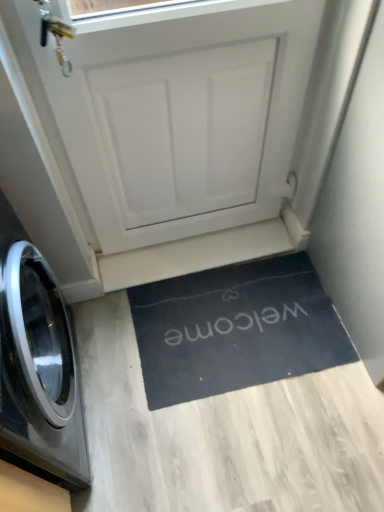
Question: From a real-world perspective, relative to black glossy washing machine at left, is white matte door at center vertically above or below?

Choices:
 (A) below
 (B) above

Answer: (B)

Question: Does point tap(261, 88) appear closer or farther from the camera than point tap(3, 270)?

Choices:
 (A) farther
 (B) closer

Answer: (A)

Question: Estimate the real-world distances between objects in this image. Which object is closer to the black rubber doormat at lower center?

Choices:
 (A) white matte door at center
 (B) black glossy washing machine at left

Answer: (B)

Question: Which object is the closest to the black rubber doormat at lower center?

Choices:
 (A) white matte door at center
 (B) black glossy washing machine at left

Answer: (B)